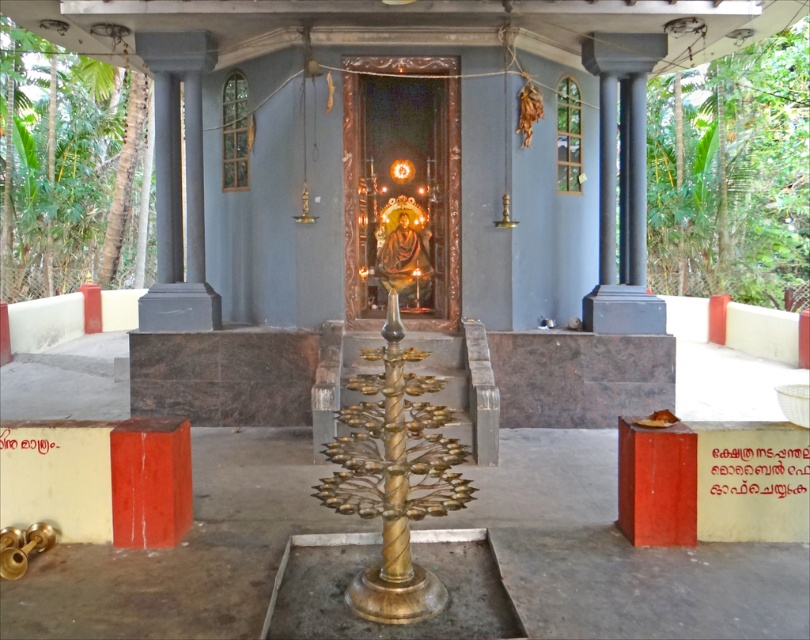
You are standing inside the temple and notice two points marked in the scene. The first point is located at coordinates point (738,211) and the second point is at point (1,252). Which of these two points is nearer to your current position as you stand inside the temple?

Point (738,211) is closer to the camera than point (1,252), so the first point is nearer to your current position.